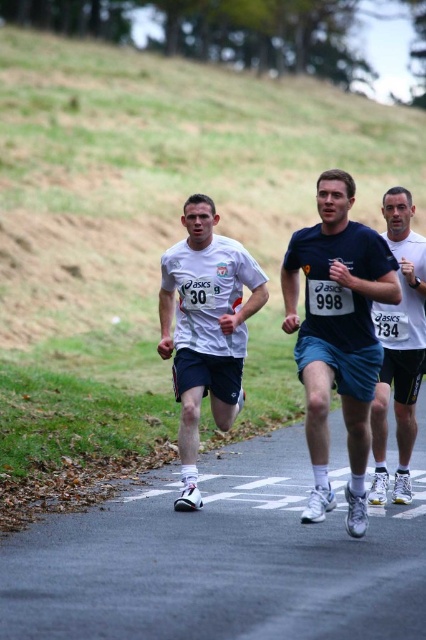
Does green grass at upper left lie in front of white matte running shoe at right?

No, green grass at upper left is further to the viewer.

Between green grass at upper left and white matte running shoe at right, which one has more height?

With more height is green grass at upper left.

Who is more distant from viewer, (221, 182) or (400, 308)?

Positioned behind is point (221, 182).

This screenshot has width=426, height=640. I want to click on green grass at upper left, so click(x=164, y=172).

Between white matte shirt at center and white matte running shoe at right, which one appears on the right side from the viewer's perspective?

From the viewer's perspective, white matte running shoe at right appears more on the right side.

Who is more distant from viewer, (172, 275) or (397, 396)?

The point (172, 275) is behind.

Does point (227, 358) come farther from viewer compared to point (396, 340)?

Yes, it is behind point (396, 340).

Find the location of a particular element. The width and height of the screenshot is (426, 640). white matte shirt at center is located at coordinates (206, 328).

Is green grass at upper left to the right of white matte shirt at center from the viewer's perspective?

Incorrect, green grass at upper left is not on the right side of white matte shirt at center.

Is point (138, 163) in front of point (230, 381)?

No, (138, 163) is further to viewer.

Where is `green grass at upper left`? The width and height of the screenshot is (426, 640). green grass at upper left is located at coordinates (164, 172).